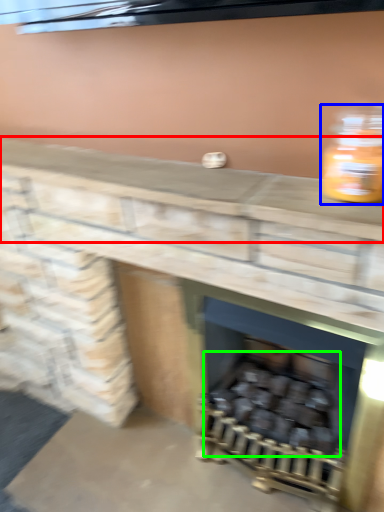
Question: Which is nearer to the counter top (highlighted by a red box)? bottle (highlighted by a blue box) or burn (highlighted by a green box).

Choices:
 (A) bottle
 (B) burn

Answer: (A)